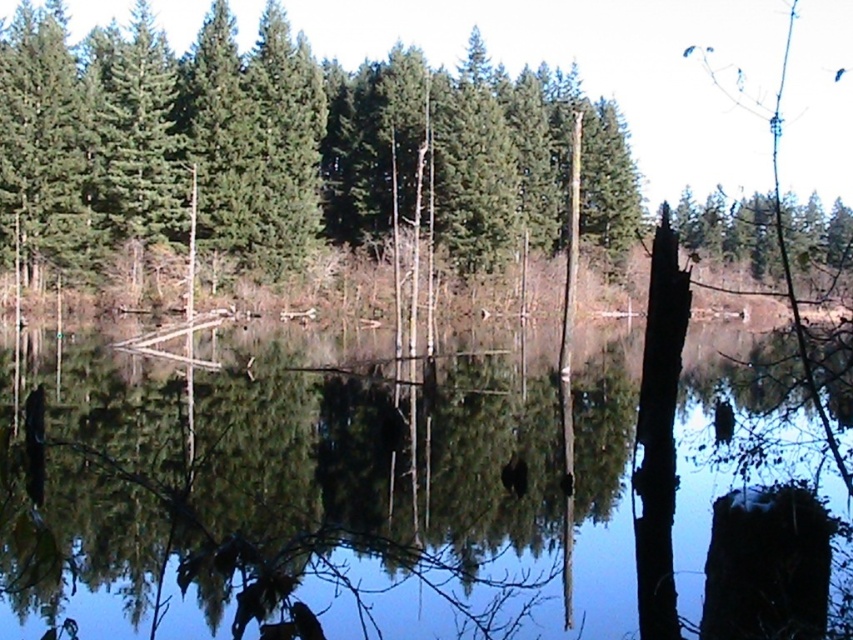
Question: Which is farther from the green matte tree at upper right?

Choices:
 (A) green matte tree at upper center
 (B) transparent water at center

Answer: (B)

Question: Which of the following is the closest to the observer?

Choices:
 (A) green matte tree at upper center
 (B) green matte tree at upper right

Answer: (B)

Question: Among these points, which one is nearest to the camera?

Choices:
 (A) (494, 477)
 (B) (704, 240)
 (C) (280, 195)

Answer: (A)

Question: Is transparent water at center positioned before green matte tree at upper center?

Choices:
 (A) no
 (B) yes

Answer: (B)

Question: Does green matte tree at upper center have a greater width compared to green matte tree at upper right?

Choices:
 (A) yes
 (B) no

Answer: (B)

Question: Is transparent water at center behind green matte tree at upper center?

Choices:
 (A) yes
 (B) no

Answer: (B)